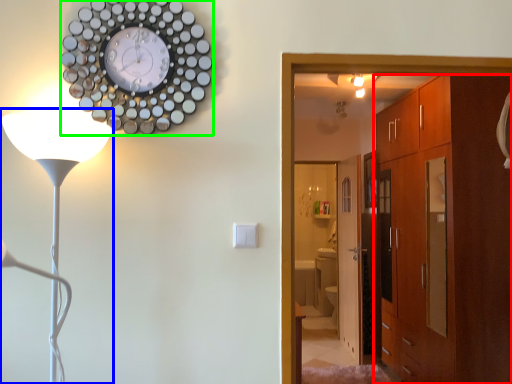
Question: Based on their relative distances, which object is nearer to cabinetry (highlighted by a red box)? Choose from lamp (highlighted by a blue box) and wall clock (highlighted by a green box).

Choices:
 (A) lamp
 (B) wall clock

Answer: (B)